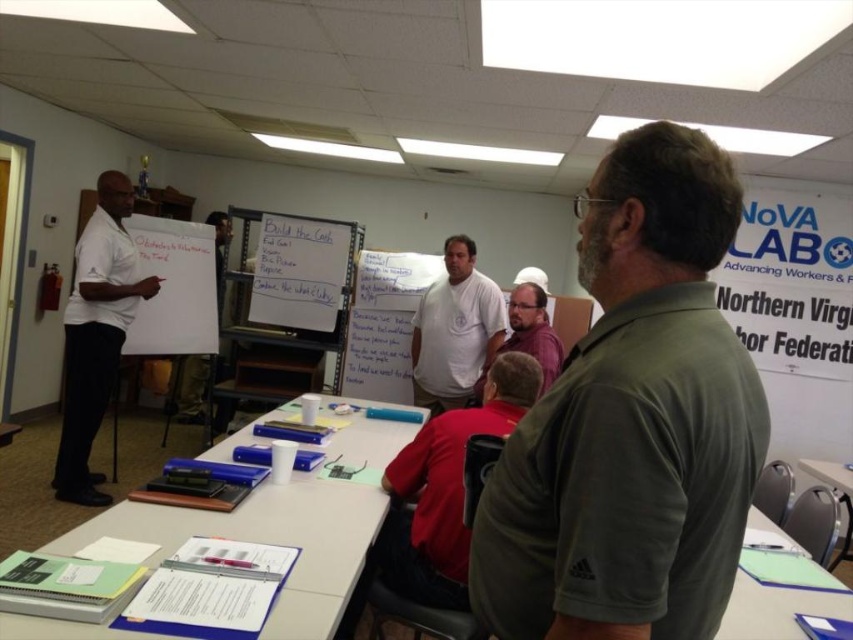
What does the point at coordinates [631,420] on the whiteboard represent in the scene?

The point at coordinates [631,420] on the whiteboard represents the green matte shirt at center.

You are a tailor observing the two shirts in the image. The green matte shirt at center and the white cotton shirt at center. Which shirt has a narrower width?

The green matte shirt at center has a lesser width compared to the white cotton shirt at center, so the green matte shirt at center is narrower.